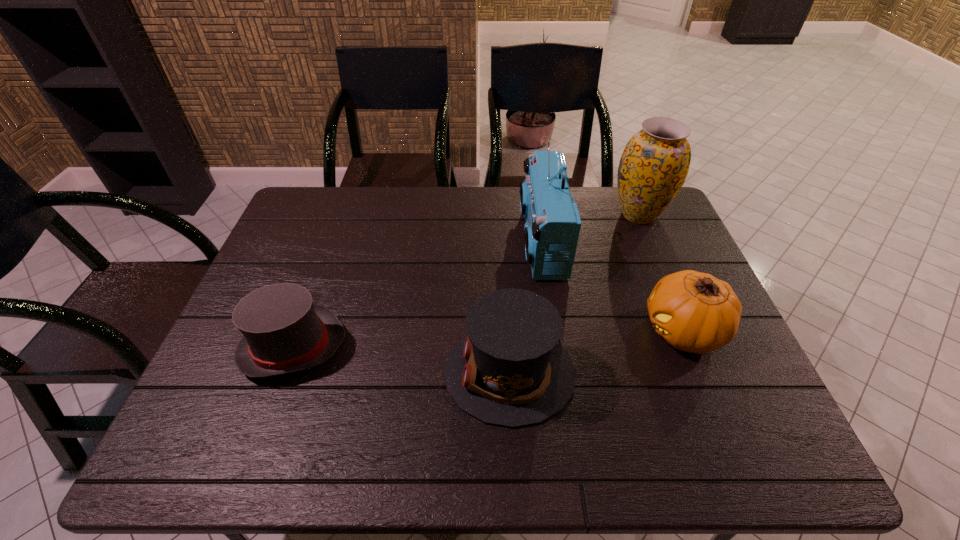
Identify the location of object that is at the left edge. The width and height of the screenshot is (960, 540). (283, 332).

Where is `vase at the right edge`? vase at the right edge is located at coordinates (653, 167).

What are the coordinates of `pumpkin that is positioned at the right edge` in the screenshot? It's located at (695, 312).

You are a GUI agent. You are given a task and a screenshot of the screen. Output one action in this format:
    pyautogui.click(x=<x>, y=<y>)
    Task: Click on the object that is at the far right corner
    
    Given the screenshot: What is the action you would take?
    pyautogui.click(x=653, y=167)

The width and height of the screenshot is (960, 540). Identify the location of free point at the far edge. coord(348,214).

The width and height of the screenshot is (960, 540). Find the location of `vacant space at the near edge of the desktop`. vacant space at the near edge of the desktop is located at coordinates (685, 454).

In the image, there is a desktop. What are the coordinates of `vacant space at the left edge` in the screenshot? It's located at (259, 421).

This screenshot has height=540, width=960. In order to click on vacant space at the right edge in this screenshot , I will do `click(682, 261)`.

This screenshot has width=960, height=540. In order to click on vacant region at the far left corner of the desktop in this screenshot , I will do `click(326, 230)`.

The image size is (960, 540). I want to click on vacant space at the far right corner of the desktop, so click(x=675, y=221).